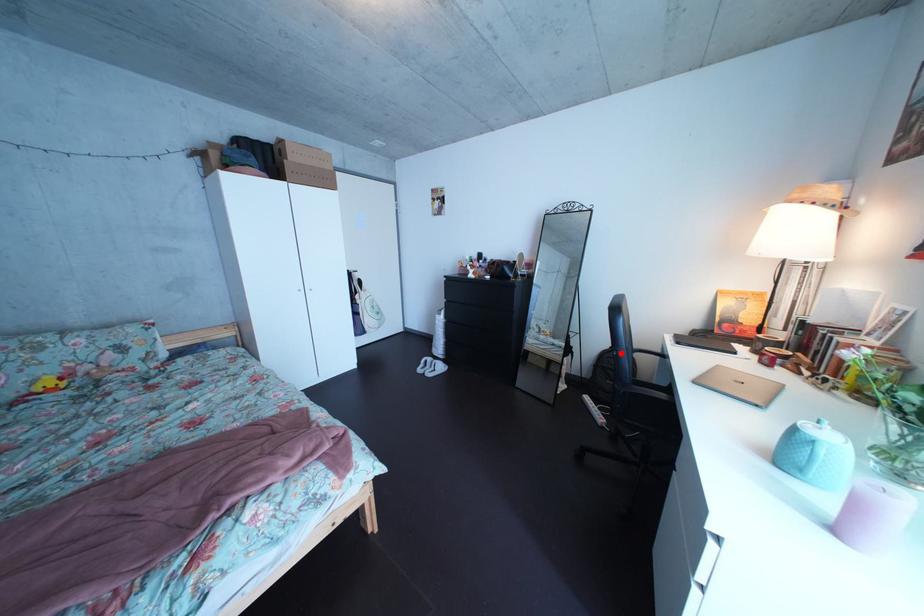
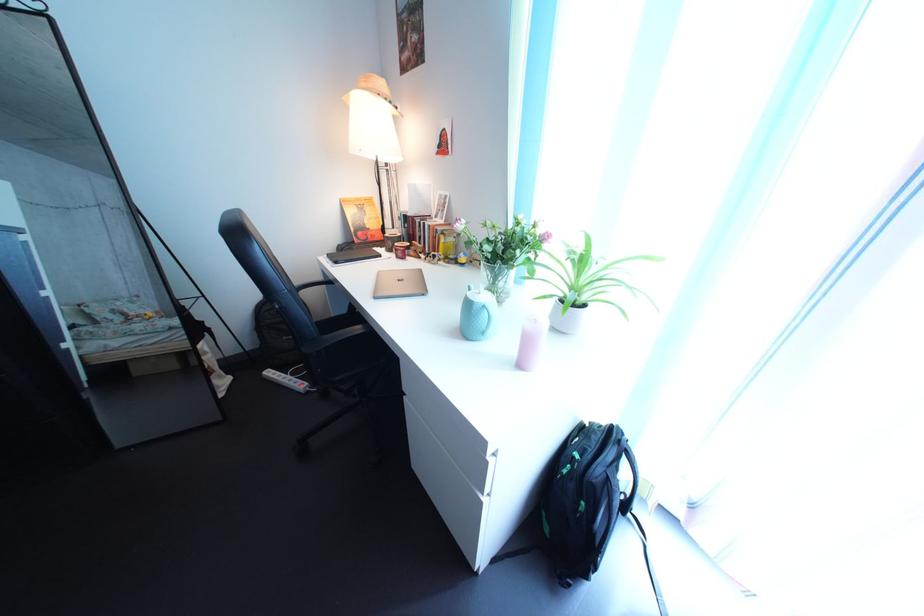
Question: I am providing you with two images of the same scene from different viewpoints. A red point is marked on the first image. Can you still see the location of the red point in image 2?

Choices:
 (A) Yes
 (B) No

Answer: (A)